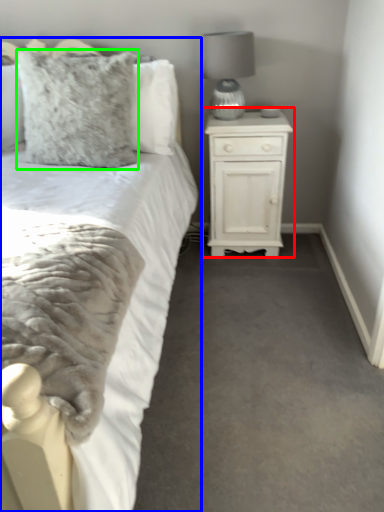
Question: Estimate the real-world distances between objects in this image. Which object is closer to nightstand (highlighted by a red box), bed (highlighted by a blue box) or pillow (highlighted by a green box)?

Choices:
 (A) bed
 (B) pillow

Answer: (B)